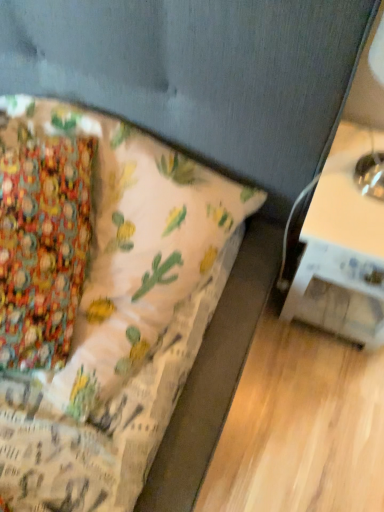
Question: Should I look upward or downward to see white glossy table at right?

Choices:
 (A) up
 (B) down

Answer: (A)

Question: Is white glossy table at right facing towards textured fabric bed at lower left?

Choices:
 (A) no
 (B) yes

Answer: (A)

Question: Considering the relative sizes of white glossy table at right and textured fabric bed at lower left in the image provided, is white glossy table at right taller than textured fabric bed at lower left?

Choices:
 (A) no
 (B) yes

Answer: (B)

Question: Is white glossy table at right outside of textured fabric bed at lower left?

Choices:
 (A) yes
 (B) no

Answer: (A)

Question: Can you confirm if white glossy table at right is thinner than textured fabric bed at lower left?

Choices:
 (A) yes
 (B) no

Answer: (A)

Question: Considering the relative sizes of white glossy table at right and textured fabric bed at lower left in the image provided, is white glossy table at right smaller than textured fabric bed at lower left?

Choices:
 (A) no
 (B) yes

Answer: (B)

Question: Is white glossy table at right far away from textured fabric bed at lower left?

Choices:
 (A) yes
 (B) no

Answer: (B)

Question: From a real-world perspective, is textured fabric bed at lower left physically above white glossy table at right?

Choices:
 (A) no
 (B) yes

Answer: (B)

Question: Is textured fabric bed at lower left not near white glossy table at right?

Choices:
 (A) yes
 (B) no

Answer: (B)

Question: Is textured fabric bed at lower left taller than white glossy table at right?

Choices:
 (A) no
 (B) yes

Answer: (A)

Question: Could white glossy table at right be considered to be inside textured fabric bed at lower left?

Choices:
 (A) yes
 (B) no

Answer: (B)

Question: Does textured fabric bed at lower left appear on the left side of white glossy table at right?

Choices:
 (A) no
 (B) yes

Answer: (B)

Question: Can you confirm if textured fabric bed at lower left is smaller than white glossy table at right?

Choices:
 (A) no
 (B) yes

Answer: (A)

Question: Based on their positions, is textured fabric bed at lower left located to the left or right of white glossy table at right?

Choices:
 (A) left
 (B) right

Answer: (A)